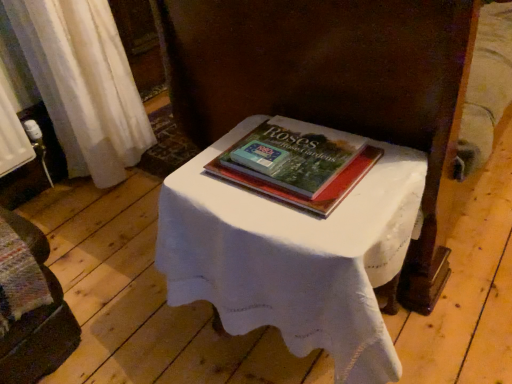
Find the location of a particular element. free spot in front of hardcover book at center is located at coordinates (308, 222).